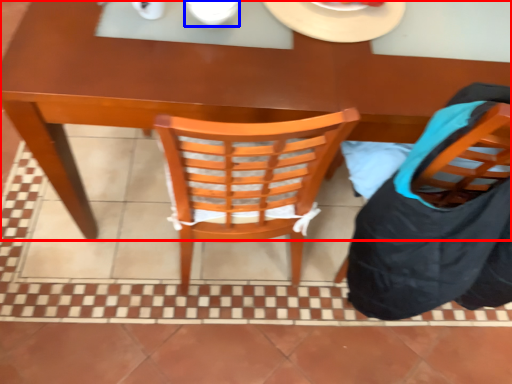
Question: Which point is closer to the camera, desk (highlighted by a red box) or tableware (highlighted by a blue box)?

Choices:
 (A) desk
 (B) tableware

Answer: (A)